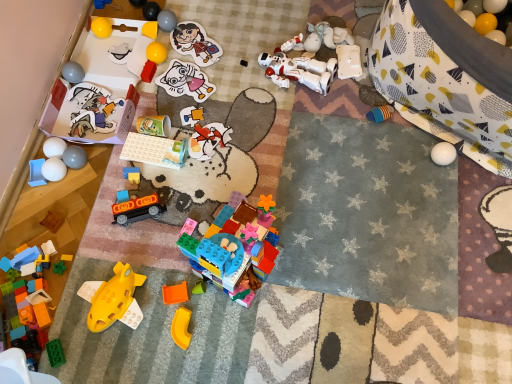
You are a GUI agent. You are given a task and a screenshot of the screen. Output one action in this format:
    pyautogui.click(x=<x>, y=<y>)
    Task: Click on the free space in front of yellow rubber ball at upper left, positioned as the 11th toy in right-to-left order
    The height and width of the screenshot is (384, 512).
    Given the screenshot: What is the action you would take?
    pyautogui.click(x=168, y=97)